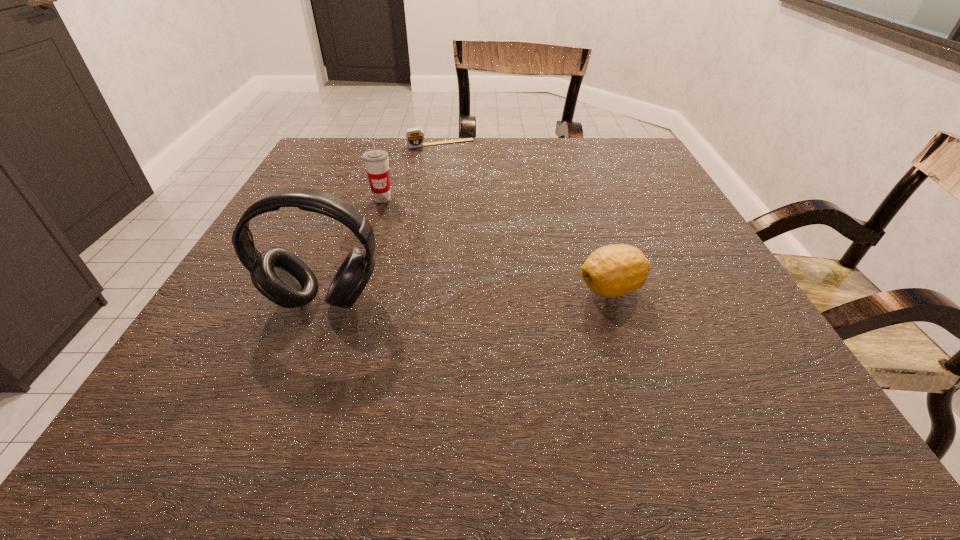
Locate an element on the screen. The width and height of the screenshot is (960, 540). vacant space on the desktop that is between the tallest object and the second shortest object and is positioned on the side of the second tallest object with the logo is located at coordinates (432, 296).

Locate an element on the screen. free space on the desktop that is between the headset and the lemon and is positioned at the front of the shortest object with the tape extended is located at coordinates (507, 293).